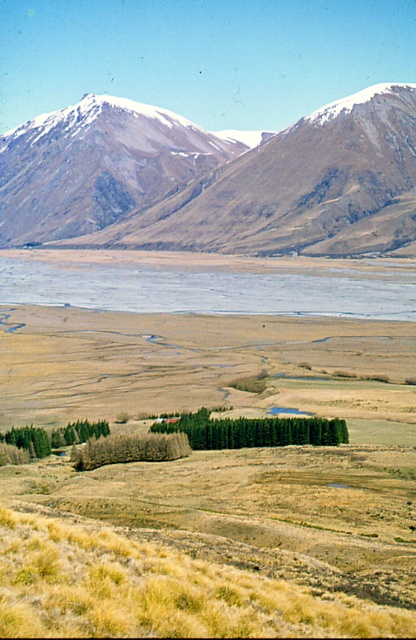
Who is more forward, (304, 472) or (296, 241)?

Point (304, 472) is in front.

Is point (339, 634) farther from camera compared to point (84, 218)?

No, (339, 634) is in front of (84, 218).

Where is `dry grassland at center`? This screenshot has width=416, height=640. dry grassland at center is located at coordinates (208, 451).

Between snowy rocky mountain range at upper center and blue water at center, which one is positioned higher?

snowy rocky mountain range at upper center is higher up.

Which is in front, point (327, 113) or point (29, 294)?

Point (29, 294)

Which is behind, point (306, 240) or point (59, 289)?

Point (306, 240)

The height and width of the screenshot is (640, 416). In order to click on snowy rocky mountain range at upper center in this screenshot , I will do `click(257, 188)`.

Consider the image. Who is positioned more to the right, dry grassland at center or blue water at center?

From the viewer's perspective, dry grassland at center appears more on the right side.

At what (x,y) coordinates should I click in order to perform the action: click on dry grassland at center. Please return your answer as a coordinate pair (x, y). Looking at the image, I should click on (208, 451).